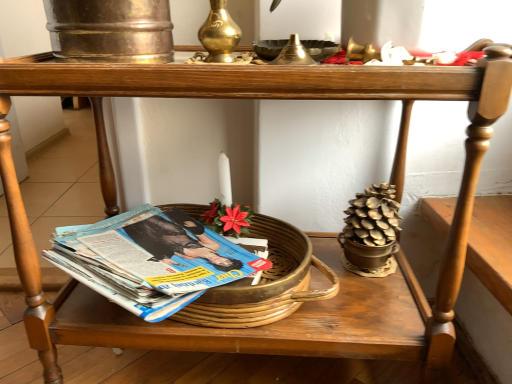
This screenshot has height=384, width=512. Describe the element at coordinates (150, 260) in the screenshot. I see `blue glossy magazine at lower left` at that location.

This screenshot has height=384, width=512. What do you see at coordinates (320, 49) in the screenshot? I see `metallic gold bowl at upper center` at bounding box center [320, 49].

Find the location of a particular element. This screenshot has width=512, height=384. brass candle holder at upper center, positioned as the 2th candle holder in right-to-left order is located at coordinates (219, 34).

Measure the distance from blue glossy magazine at lower left to gold metallic candle holder at upper center, the second candle holder in the left-to-right sequence.

blue glossy magazine at lower left is 15.60 inches away from gold metallic candle holder at upper center, the second candle holder in the left-to-right sequence.

Between point (69, 229) and point (298, 64), which one is positioned behind?

Positioned behind is point (69, 229).

Is blue glossy magazine at lower left thinner than gold metallic candle holder at upper center, acting as the first candle holder starting from the right?

In fact, blue glossy magazine at lower left might be wider than gold metallic candle holder at upper center, acting as the first candle holder starting from the right.

Relative to gold metallic candle holder at upper center, acting as the first candle holder starting from the right, is blue glossy magazine at lower left in front or behind?

Clearly, blue glossy magazine at lower left is behind gold metallic candle holder at upper center, acting as the first candle holder starting from the right.

Is point (280, 44) less distant than point (304, 63)?

That is False.

Is gold metallic candle holder at upper center, the second candle holder in the left-to-right sequence, at the back of metallic gold bowl at upper center?

metallic gold bowl at upper center is not turned away from gold metallic candle holder at upper center, the second candle holder in the left-to-right sequence.

Looking at this image, considering the relative positions of metallic gold bowl at upper center and gold metallic candle holder at upper center, the second candle holder in the left-to-right sequence, in the image provided, is metallic gold bowl at upper center to the right of gold metallic candle holder at upper center, the second candle holder in the left-to-right sequence, from the viewer's perspective?

Yes, metallic gold bowl at upper center is to the right of gold metallic candle holder at upper center, the second candle holder in the left-to-right sequence.

Considering their positions, is metallic gold bowl at upper center located in front of or behind gold metallic candle holder at upper center, acting as the first candle holder starting from the right?

metallic gold bowl at upper center is behind gold metallic candle holder at upper center, acting as the first candle holder starting from the right.

From a real-world perspective, is gold metallic candle holder at upper center, the second candle holder in the left-to-right sequence, located beneath brass candle holder at upper center, placed as the 1th candle holder when sorted from left to right?

Yes, from a real-world perspective, gold metallic candle holder at upper center, the second candle holder in the left-to-right sequence, is beneath brass candle holder at upper center, placed as the 1th candle holder when sorted from left to right.

Can you tell me how much gold metallic candle holder at upper center, acting as the first candle holder starting from the right, and brass candle holder at upper center, positioned as the 2th candle holder in right-to-left order, differ in facing direction?

They differ by 0.619 degrees in their facing directions.

Is point (308, 54) in front of point (207, 18)?

Yes, point (308, 54) is in front of point (207, 18).

Is gold metallic candle holder at upper center, acting as the first candle holder starting from the right, to the left or to the right of brass candle holder at upper center, positioned as the 2th candle holder in right-to-left order, in the image?

Clearly, gold metallic candle holder at upper center, acting as the first candle holder starting from the right, is on the right of brass candle holder at upper center, positioned as the 2th candle holder in right-to-left order, in the image.

Who is bigger, gold metallic candle holder at upper center, acting as the first candle holder starting from the right, or wooden table at lower center?

With larger size is wooden table at lower center.

Does gold metallic candle holder at upper center, the second candle holder in the left-to-right sequence, lie behind wooden table at lower center?

No, the depth of gold metallic candle holder at upper center, the second candle holder in the left-to-right sequence, is less than that of wooden table at lower center.

Does gold metallic candle holder at upper center, the second candle holder in the left-to-right sequence, appear on the right side of wooden table at lower center?

Correct, you'll find gold metallic candle holder at upper center, the second candle holder in the left-to-right sequence, to the right of wooden table at lower center.

Considering the relative sizes of gold metallic candle holder at upper center, acting as the first candle holder starting from the right, and wooden table at lower center in the image provided, is gold metallic candle holder at upper center, acting as the first candle holder starting from the right, thinner than wooden table at lower center?

Correct, the width of gold metallic candle holder at upper center, acting as the first candle holder starting from the right, is less than that of wooden table at lower center.

Is gold metallic candle holder at upper center, the second candle holder in the left-to-right sequence, aimed at metallic gold bowl at upper center?

No, gold metallic candle holder at upper center, the second candle holder in the left-to-right sequence, is not oriented towards metallic gold bowl at upper center.

Between point (298, 41) and point (279, 47), which one is positioned behind?

The point (298, 41) is farther from the camera.

Does gold metallic candle holder at upper center, the second candle holder in the left-to-right sequence, touch metallic gold bowl at upper center?

Yes, gold metallic candle holder at upper center, the second candle holder in the left-to-right sequence, is right next to metallic gold bowl at upper center and making contact.

From a real-world perspective, is metallic gold bowl at upper center beneath wooden table at lower center?

Actually, metallic gold bowl at upper center is physically above wooden table at lower center in the real world.

Is metallic gold bowl at upper center wider or thinner than wooden table at lower center?

Clearly, metallic gold bowl at upper center has less width compared to wooden table at lower center.

Who is more distant, metallic gold bowl at upper center or wooden table at lower center?

wooden table at lower center is further from the camera.

In the image, is blue glossy magazine at lower left positioned in front of or behind wooden table at lower center?

blue glossy magazine at lower left is in front of wooden table at lower center.

Based on the photo, how many degrees apart are the facing directions of blue glossy magazine at lower left and wooden table at lower center?

They differ by 83.9 degrees in their facing directions.

From a real-world perspective, which object stands above the other?

blue glossy magazine at lower left.

Choose the correct answer: Is blue glossy magazine at lower left inside wooden table at lower center or outside it?

blue glossy magazine at lower left is not enclosed by wooden table at lower center.

There is a blue glossy magazine at lower left. At what (x,y) coordinates should I click in order to perform the action: click on the 1st candle holder above it (from the image's perspective). Please return your answer as a coordinate pair (x, y). The height and width of the screenshot is (384, 512). Looking at the image, I should click on coord(294,54).

This screenshot has height=384, width=512. Find the location of `candle holder that is the 1st one when counting leftward from the metallic gold bowl at upper center`. candle holder that is the 1st one when counting leftward from the metallic gold bowl at upper center is located at coordinates 294,54.

Estimate the real-world distances between objects in this image. Which object is further from gold metallic candle holder at upper center, the second candle holder in the left-to-right sequence, brass candle holder at upper center, positioned as the 2th candle holder in right-to-left order, or wooden table at lower center?

The object further to gold metallic candle holder at upper center, the second candle holder in the left-to-right sequence, is wooden table at lower center.

Based on their spatial positions, is gold metallic candle holder at upper center, acting as the first candle holder starting from the right, or brass candle holder at upper center, positioned as the 2th candle holder in right-to-left order, further from blue glossy magazine at lower left?

Based on the image, gold metallic candle holder at upper center, acting as the first candle holder starting from the right, appears to be further to blue glossy magazine at lower left.

Based on their spatial positions, is brass candle holder at upper center, placed as the 1th candle holder when sorted from left to right, or metallic gold bowl at upper center closer to blue glossy magazine at lower left?

brass candle holder at upper center, placed as the 1th candle holder when sorted from left to right, is closer to blue glossy magazine at lower left.

Looking at the image, which one is located further to metallic gold bowl at upper center, wooden table at lower center or brass candle holder at upper center, placed as the 1th candle holder when sorted from left to right?

The object further to metallic gold bowl at upper center is wooden table at lower center.

Based on their spatial positions, is metallic gold bowl at upper center or blue glossy magazine at lower left closer to brass candle holder at upper center, placed as the 1th candle holder when sorted from left to right?

metallic gold bowl at upper center is closer to brass candle holder at upper center, placed as the 1th candle holder when sorted from left to right.

Based on their spatial positions, is blue glossy magazine at lower left or gold metallic candle holder at upper center, acting as the first candle holder starting from the right, closer to brass candle holder at upper center, positioned as the 2th candle holder in right-to-left order?

The object closer to brass candle holder at upper center, positioned as the 2th candle holder in right-to-left order, is gold metallic candle holder at upper center, acting as the first candle holder starting from the right.

From the image, which object appears to be farther from gold metallic candle holder at upper center, acting as the first candle holder starting from the right, blue glossy magazine at lower left or wooden table at lower center?

wooden table at lower center is further to gold metallic candle holder at upper center, acting as the first candle holder starting from the right.

Looking at the image, which one is located further to wooden table at lower center, gold metallic candle holder at upper center, acting as the first candle holder starting from the right, or brass candle holder at upper center, placed as the 1th candle holder when sorted from left to right?

brass candle holder at upper center, placed as the 1th candle holder when sorted from left to right, is positioned further to the anchor wooden table at lower center.

You are a GUI agent. You are given a task and a screenshot of the screen. Output one action in this format:
    pyautogui.click(x=<x>, y=<y>)
    Task: Click on the bowl between brass candle holder at upper center, placed as the 1th candle holder when sorted from left to right, and blue glossy magazine at lower left vertically
    This screenshot has width=512, height=384.
    Given the screenshot: What is the action you would take?
    pyautogui.click(x=320, y=49)

Image resolution: width=512 pixels, height=384 pixels. Identify the location of paperback book that lies between brass candle holder at upper center, positioned as the 2th candle holder in right-to-left order, and wooden table at lower center from top to bottom. (150, 260).

This screenshot has height=384, width=512. I want to click on candle holder between brass candle holder at upper center, placed as the 1th candle holder when sorted from left to right, and blue glossy magazine at lower left, in the vertical direction, so click(x=294, y=54).

This screenshot has height=384, width=512. In order to click on paperback book that lies between metallic gold bowl at upper center and wooden table at lower center from top to bottom in this screenshot , I will do `click(150, 260)`.